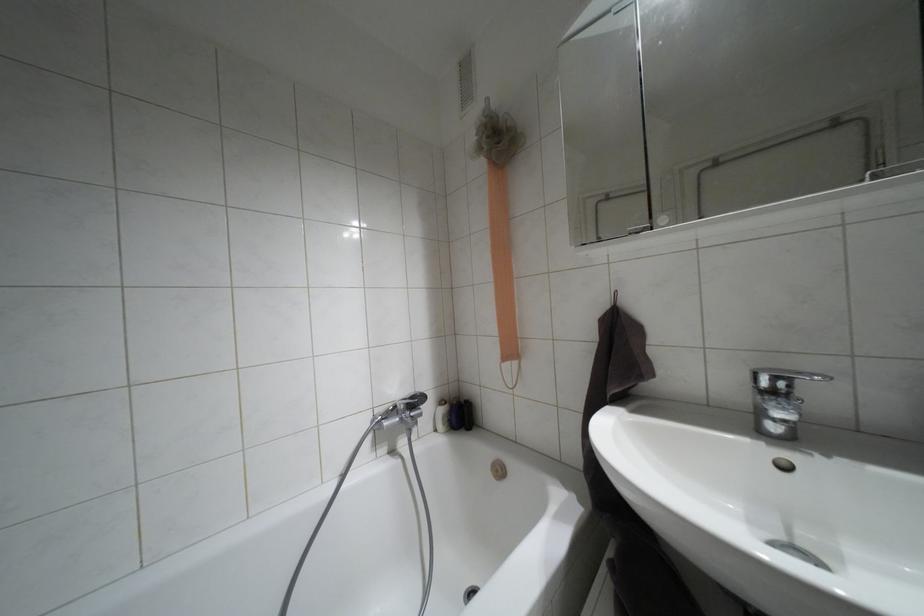
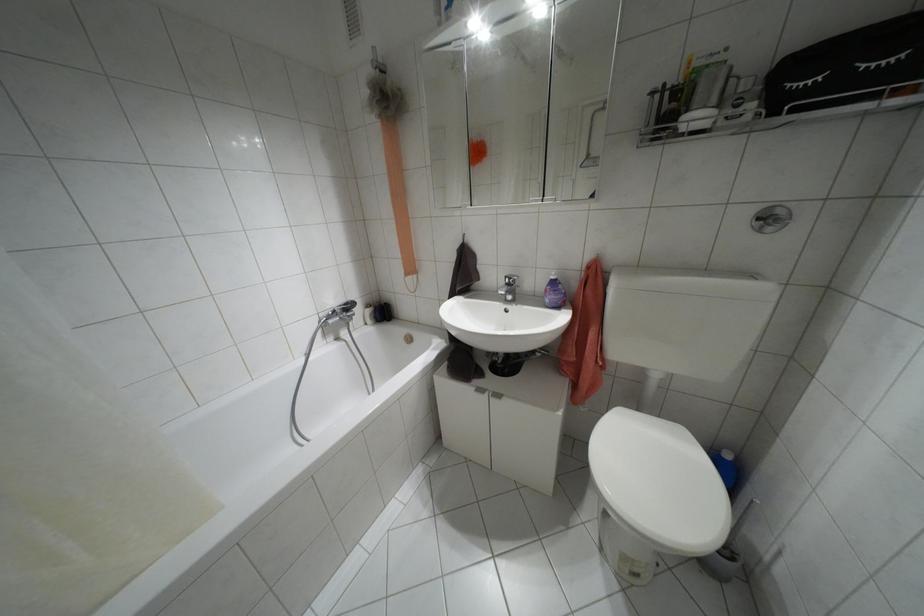
Locate, in the second image, the point that corresponds to pixel 772 392 in the first image.

(507, 284)